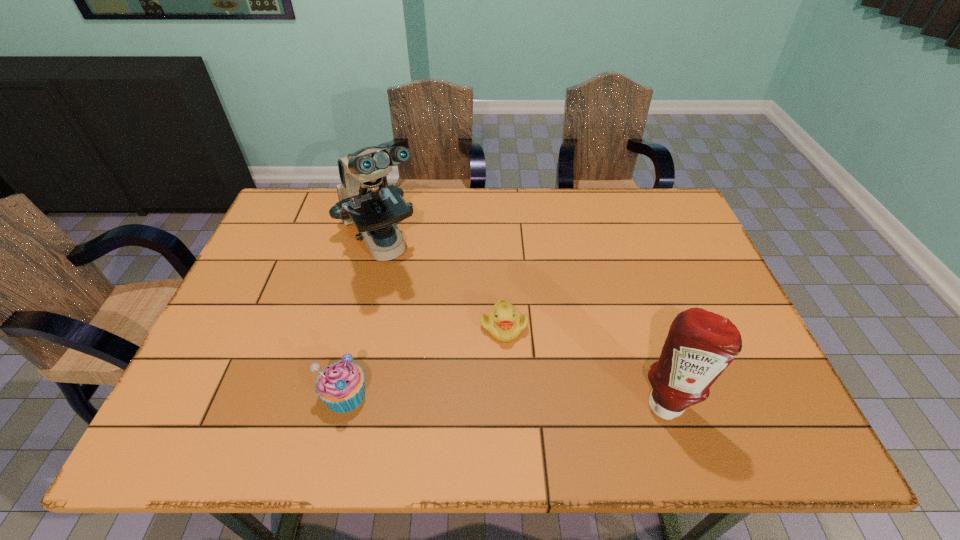
Where is `free space that is in between the tallest object and the third tallest object`? The image size is (960, 540). free space that is in between the tallest object and the third tallest object is located at coordinates (363, 319).

Image resolution: width=960 pixels, height=540 pixels. What are the coordinates of `empty space that is in between the third object from left to right and the rightmost object` in the screenshot? It's located at (585, 363).

This screenshot has height=540, width=960. In order to click on free space that is in between the microscope and the duckling in this screenshot , I will do `click(443, 285)`.

You are a GUI agent. You are given a task and a screenshot of the screen. Output one action in this format:
    pyautogui.click(x=<x>, y=<y>)
    Task: Click on the object that stands as the closest to the muffin
    Image resolution: width=960 pixels, height=540 pixels.
    Given the screenshot: What is the action you would take?
    pyautogui.click(x=504, y=322)

Locate which object ranks second in proximity to the farthest object. Please provide its 2D coordinates. Your answer should be formatted as a tuple, i.e. [(x, y)], where the tuple contains the x and y coordinates of a point satisfying the conditions above.

[(340, 385)]

In order to click on free space that satisfies the following two spatial constraints: 1. on the back side of the farthest object; 2. on the left side of the third tallest object in this screenshot , I will do `click(380, 244)`.

Where is `free point that satisfies the following two spatial constraints: 1. on the back side of the shortest object; 2. on the right side of the second shortest object`? free point that satisfies the following two spatial constraints: 1. on the back side of the shortest object; 2. on the right side of the second shortest object is located at coordinates pos(361,326).